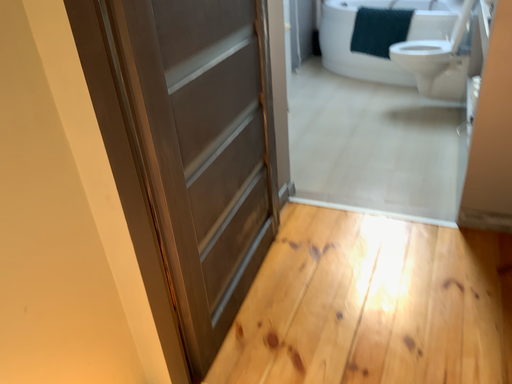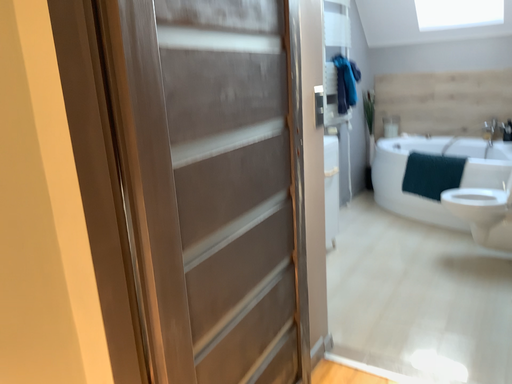
Question: How did the camera likely rotate when shooting the video?

Choices:
 (A) rotated left
 (B) rotated right

Answer: (A)